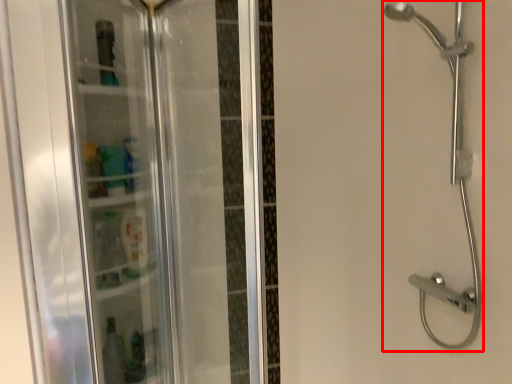
Question: From the image's perspective, what is the correct spatial positioning of shower (annotated by the red box) in reference to screen door?

Choices:
 (A) below
 (B) above

Answer: (B)